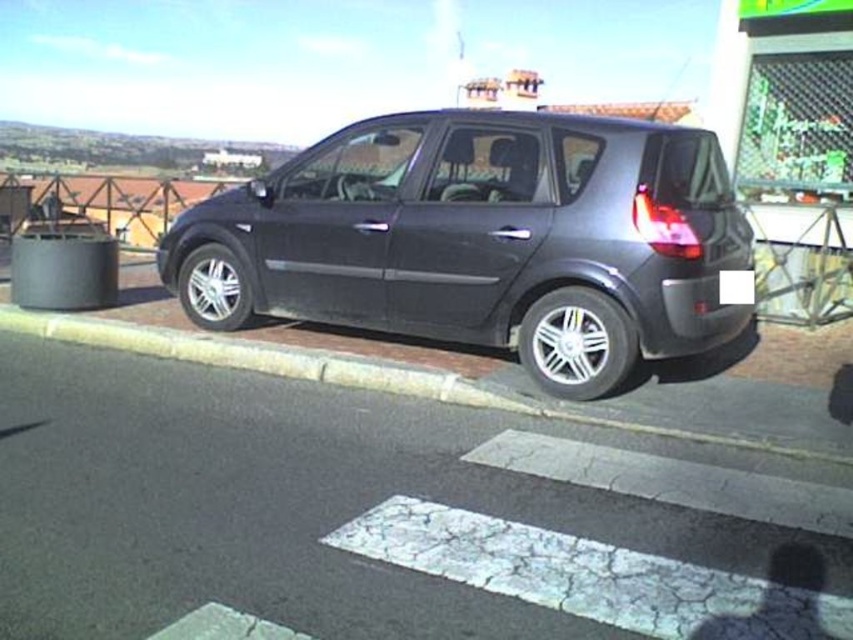
Question: Does satin black car at center have a greater width compared to brick at lower center?

Choices:
 (A) yes
 (B) no

Answer: (A)

Question: In this image, where is brick at lower center located relative to black plastic license plate at rear?

Choices:
 (A) above
 (B) below

Answer: (B)

Question: Which of the following is the closest to the observer?

Choices:
 (A) (245, 189)
 (B) (15, 307)

Answer: (A)

Question: Which of the following is the farthest from the observer?

Choices:
 (A) (614, 118)
 (B) (740, 300)

Answer: (B)

Question: Which of the following is the farthest from the observer?

Choices:
 (A) (741, 285)
 (B) (409, 310)

Answer: (B)

Question: Does satin black car at center appear over black plastic license plate at rear?

Choices:
 (A) no
 (B) yes

Answer: (B)